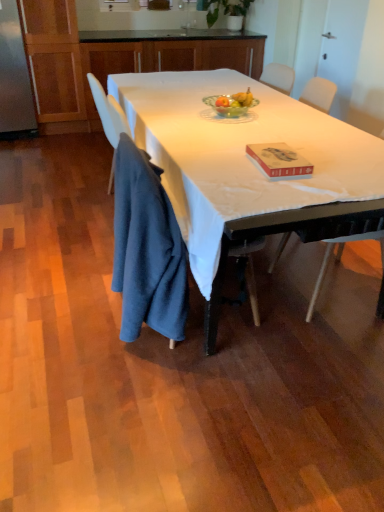
Where is `vacant space in front of green glass bowl at center`? vacant space in front of green glass bowl at center is located at coordinates (242, 128).